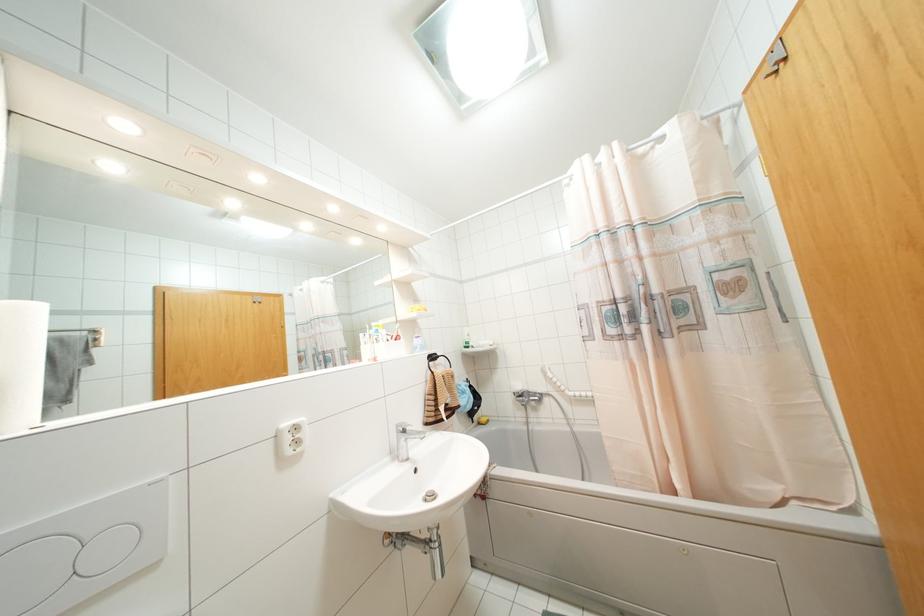
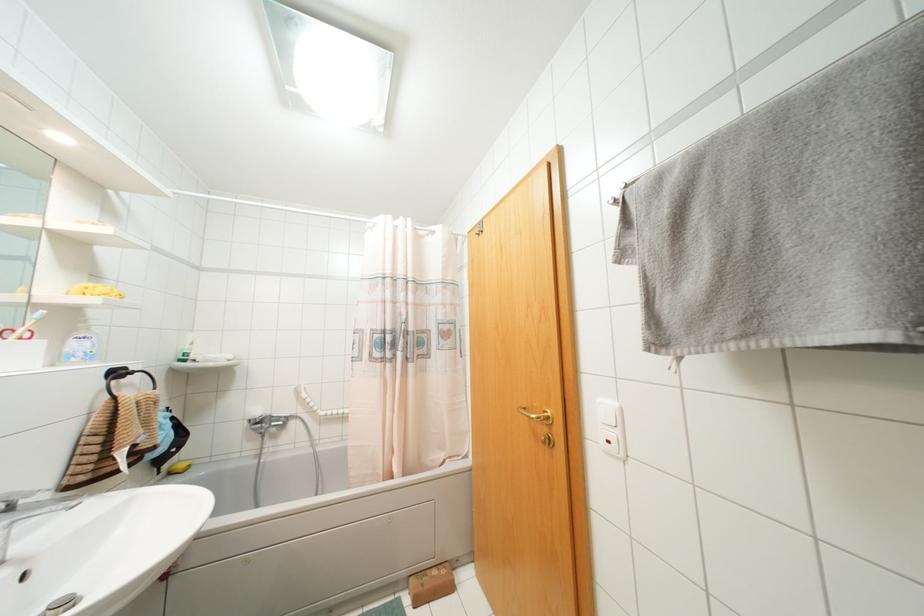
Where in the second image is the point corresponding to pixel 418 321 from the first image?

(89, 310)